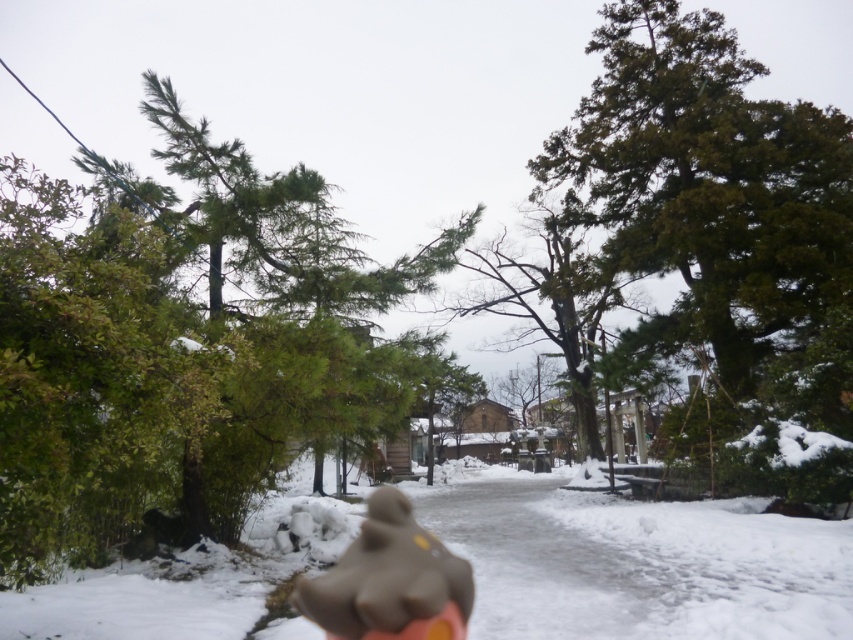
Question: Estimate the real-world distances between objects in this image. Which object is closer to the green matte tree at upper left?

Choices:
 (A) white fluffy snow at center
 (B) brown matte teddy bear at center

Answer: (B)

Question: Is green matte tree at upper left positioned behind green textured tree at upper right?

Choices:
 (A) no
 (B) yes

Answer: (A)

Question: Which point is farther to the camera?

Choices:
 (A) green textured tree at upper right
 (B) white fluffy snow at center
 (C) green matte tree at upper left

Answer: (A)

Question: Does green matte tree at upper left come behind white fluffy snow at center?

Choices:
 (A) no
 (B) yes

Answer: (A)

Question: Where is green textured tree at upper right located in relation to white fluffy snow at center in the image?

Choices:
 (A) left
 (B) right

Answer: (B)

Question: Which of the following is the farthest from the observer?

Choices:
 (A) green textured tree at upper right
 (B) white fluffy snow at center
 (C) green matte tree at upper left

Answer: (A)